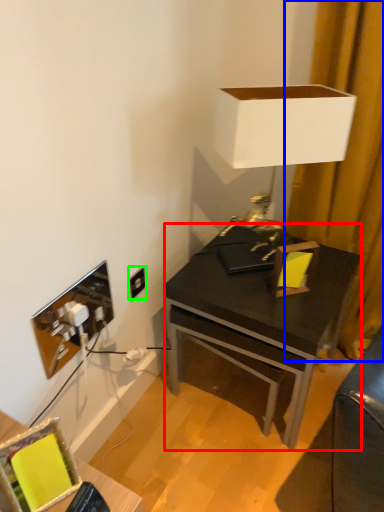
Question: Estimate the real-world distances between objects in this image. Which object is closer to desk (highlighted by a red box), curtain (highlighted by a blue box) or power outlet (highlighted by a green box)?

Choices:
 (A) curtain
 (B) power outlet

Answer: (A)